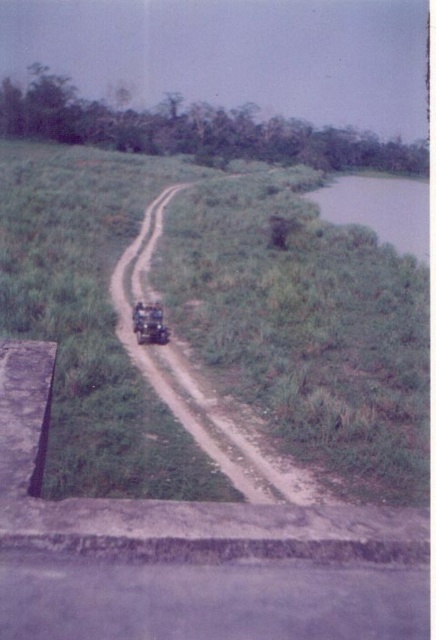
You are driving a metallic matte jeep at center and want to stay on the brown dirt track at center. Which direction should you steer the jeep to keep it on the track?

The brown dirt track at center is positioned on the left side of the metallic matte jeep at center, so you should steer the jeep to the left to keep it on the track.

You are driving a metallic matte jeep at center and want to turn around on the brown dirt track at center. Considering the space available, can you safely make a U turn without leaving the track?

The brown dirt track at center and metallic matte jeep at center are 15.19 feet apart. Since the distance between them is sufficient for a U turn, you can safely make the turn without leaving the track.

You are a hiker standing at the starting point of the brown dirt track at center. You want to reach a cabin located 10 meters ahead along the track. Can you reach it without walking further than 10 meters?

The distance from the camera to the brown dirt track at center is 8.42 meters. Since the cabin is 10 meters ahead along the track, you can reach it without exceeding the 10 meters distance.